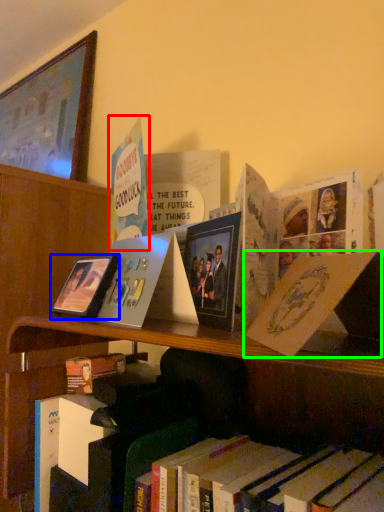
Question: Which object is positioned farthest from book (highlighted by a red box)? Select from picture frame (highlighted by a blue box) and paperback book (highlighted by a green box).

Choices:
 (A) picture frame
 (B) paperback book

Answer: (B)